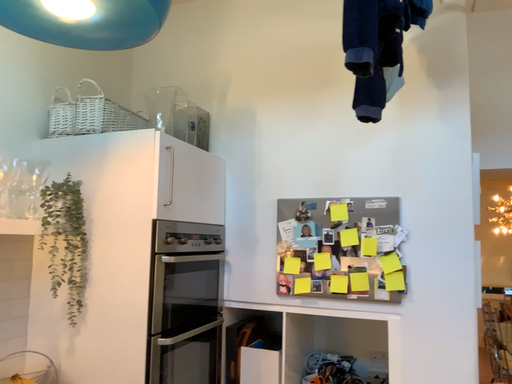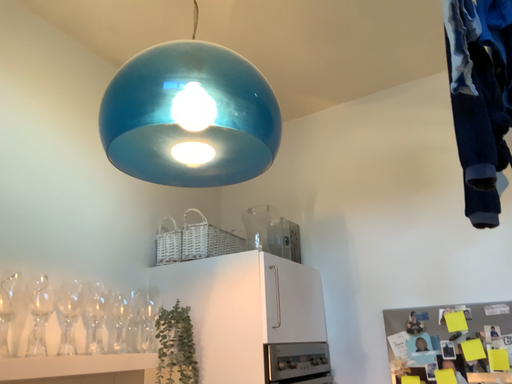
Question: Which way did the camera rotate in the video?

Choices:
 (A) rotated left
 (B) rotated right

Answer: (A)